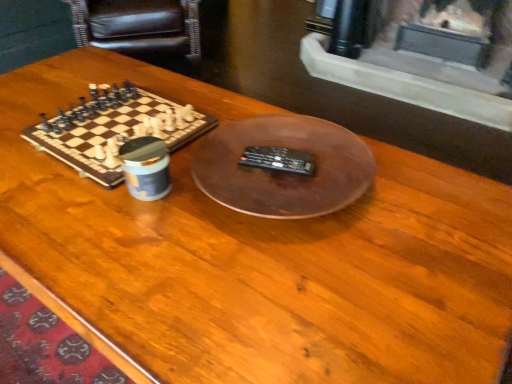
Question: Is black leather armchair at upper left positioned behind wooden chessboard at left?

Choices:
 (A) no
 (B) yes

Answer: (B)

Question: Is black leather armchair at upper left taller than wooden chessboard at left?

Choices:
 (A) yes
 (B) no

Answer: (A)

Question: Is black leather armchair at upper left completely or partially outside of wooden chessboard at left?

Choices:
 (A) yes
 (B) no

Answer: (A)

Question: Is wooden chessboard at left surrounded by black leather armchair at upper left?

Choices:
 (A) yes
 (B) no

Answer: (B)

Question: From a real-world perspective, is black leather armchair at upper left over wooden chessboard at left?

Choices:
 (A) no
 (B) yes

Answer: (A)

Question: Can you confirm if black leather armchair at upper left is bigger than wooden chessboard at left?

Choices:
 (A) no
 (B) yes

Answer: (B)

Question: Does wooden chessboard at left appear on the left side of black leather armchair at upper left?

Choices:
 (A) no
 (B) yes

Answer: (A)

Question: Considering the relative sizes of wooden chessboard at left and black leather armchair at upper left in the image provided, is wooden chessboard at left wider than black leather armchair at upper left?

Choices:
 (A) yes
 (B) no

Answer: (B)

Question: Does wooden chessboard at left turn towards black leather armchair at upper left?

Choices:
 (A) yes
 (B) no

Answer: (B)

Question: Does wooden chessboard at left have a smaller size compared to black leather armchair at upper left?

Choices:
 (A) no
 (B) yes

Answer: (B)

Question: From a real-world perspective, is wooden chessboard at left under black leather armchair at upper left?

Choices:
 (A) no
 (B) yes

Answer: (A)

Question: Is wooden chessboard at left not inside black leather armchair at upper left?

Choices:
 (A) yes
 (B) no

Answer: (A)

Question: Choose the correct answer: Is wooden chessboard at left inside black leather armchair at upper left or outside it?

Choices:
 (A) outside
 (B) inside

Answer: (A)